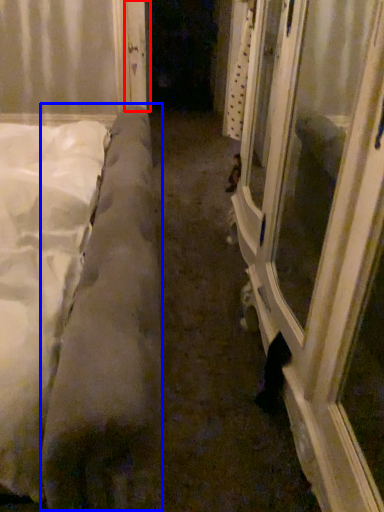
Question: Among these objects, which one is farthest to the camera, door (highlighted by a red box) or mattress (highlighted by a blue box)?

Choices:
 (A) door
 (B) mattress

Answer: (A)